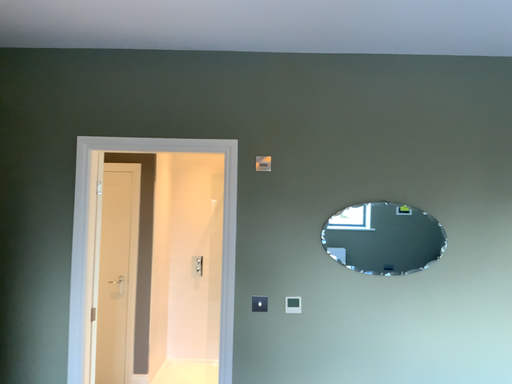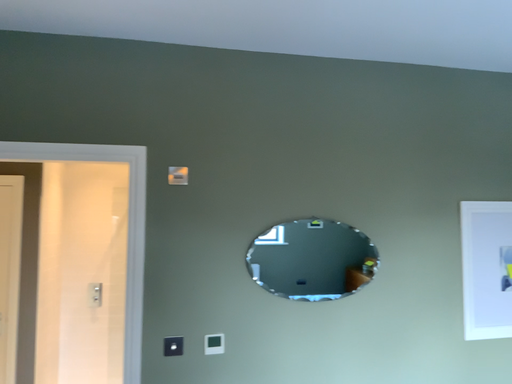
Question: How did the camera likely rotate when shooting the video?

Choices:
 (A) rotated left
 (B) rotated right

Answer: (B)